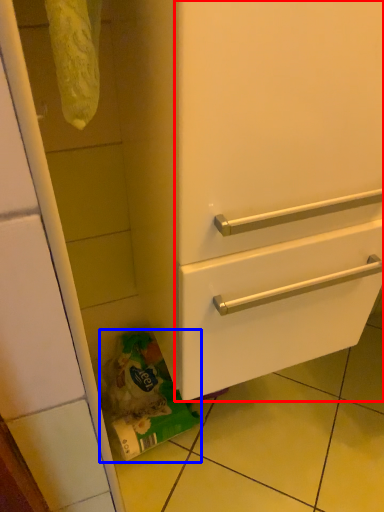
Question: Which object is further to the camera taking this photo, door (highlighted by a red box) or garbage (highlighted by a blue box)?

Choices:
 (A) door
 (B) garbage

Answer: (B)